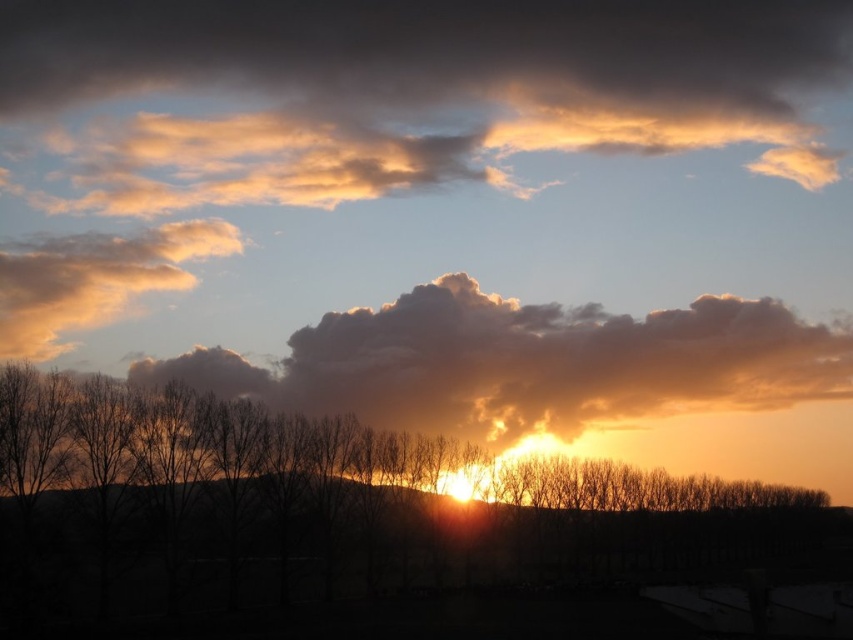
Can you confirm if cloudy sky at center is positioned above golden fluffy cloud at upper left?

No.

Describe the element at coordinates (532, 364) in the screenshot. The image size is (853, 640). I see `cloudy sky at center` at that location.

At what (x,y) coordinates should I click in order to perform the action: click on cloudy sky at center. Please return your answer as a coordinate pair (x, y). The height and width of the screenshot is (640, 853). Looking at the image, I should click on (532, 364).